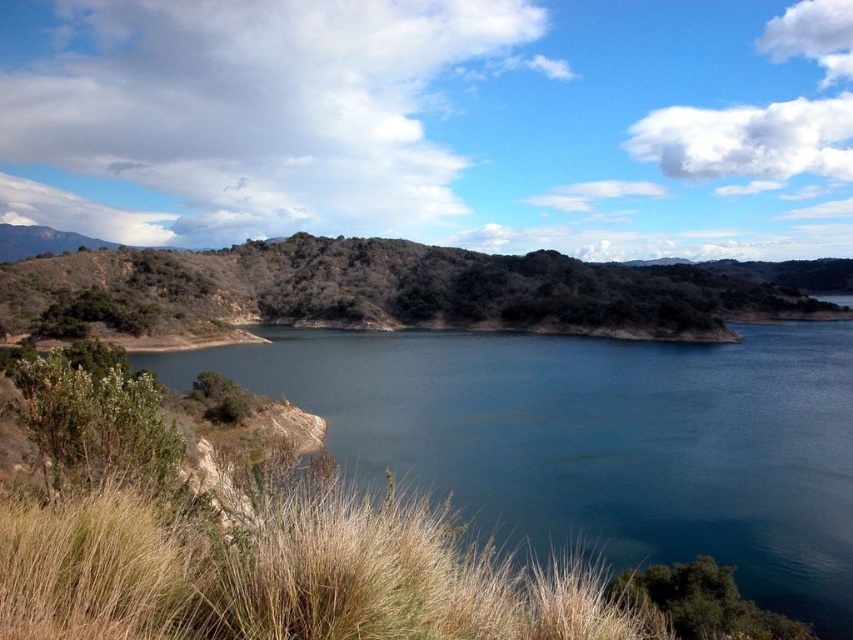
In order to click on blue water at center in this screenshot , I will do `click(599, 440)`.

Who is positioned more to the right, blue water at center or green textured hillside at center?

blue water at center is more to the right.

What are the coordinates of `blue water at center` in the screenshot? It's located at (599, 440).

Identify the location of blue water at center. (599, 440).

Who is more distant from viewer, (556, 538) or (398, 524)?

Positioned behind is point (556, 538).

This screenshot has width=853, height=640. Identify the location of blue water at center. (599, 440).

Between point (647, 410) and point (364, 634), which one is positioned behind?

Point (647, 410)

You are a GUI agent. You are given a task and a screenshot of the screen. Output one action in this format:
    pyautogui.click(x=<x>, y=<y>)
    Task: Click on the blue water at center
    This screenshot has width=853, height=640.
    Given the screenshot: What is the action you would take?
    pyautogui.click(x=599, y=440)

Based on the photo, can you confirm if dry grass at lower left is smaller than green textured hillside at center?

Indeed, dry grass at lower left has a smaller size compared to green textured hillside at center.

Between point (13, 515) and point (331, 310), which one is positioned in front?

Positioned in front is point (13, 515).

Identify the location of dry grass at lower left. (281, 577).